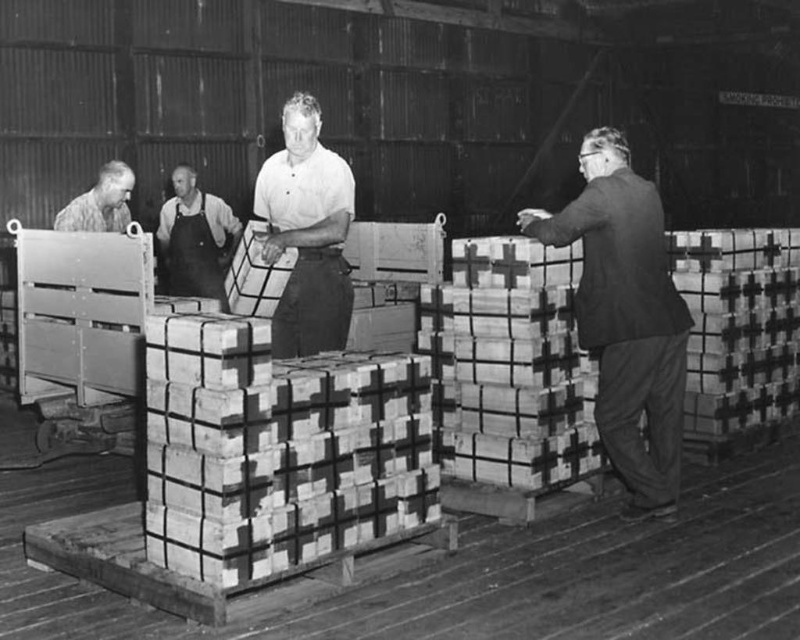
Who is positioned more to the left, smooth dark suit at right or dark gray apron at center?

Positioned to the left is dark gray apron at center.

Is point (662, 484) behind point (166, 204)?

No, it is in front of (166, 204).

Where is `smooth dark suit at right`? smooth dark suit at right is located at coordinates (625, 317).

At what (x,y) coordinates should I click in order to perform the action: click on smooth dark suit at right. Please return your answer as a coordinate pair (x, y). Looking at the image, I should click on (625, 317).

Looking at this image, does smooth white shirt at center have a larger size compared to dark gray apron at center?

No, smooth white shirt at center is not bigger than dark gray apron at center.

Which is below, smooth white shirt at center or dark gray apron at center?

smooth white shirt at center

Does point (306, 339) come farther from viewer compared to point (208, 204)?

That is False.

The width and height of the screenshot is (800, 640). What are the coordinates of `smooth white shirt at center` in the screenshot? It's located at (308, 232).

Who is more distant from viewer, (648, 428) or (113, 225)?

The point (113, 225) is more distant.

Is point (654, 288) farther from camera compared to point (80, 221)?

No, (654, 288) is closer to viewer.

Identify the location of smooth dark suit at right. The width and height of the screenshot is (800, 640). (625, 317).